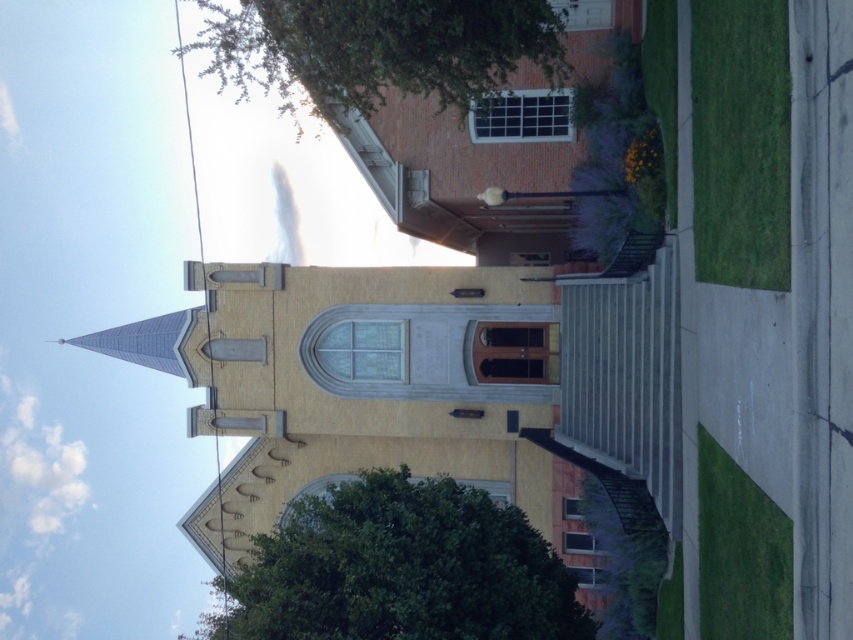
You are standing at the entrance of the church and want to walk to the green leafy tree at upper center. There is a green leafy tree at center blocking your path. Can you walk around it to reach your destination?

The green leafy tree at center is 53.24 feet away from the green leafy tree at upper center, so you can walk around the green leafy tree at center to reach the green leafy tree at upper center since they are not too close to each other.